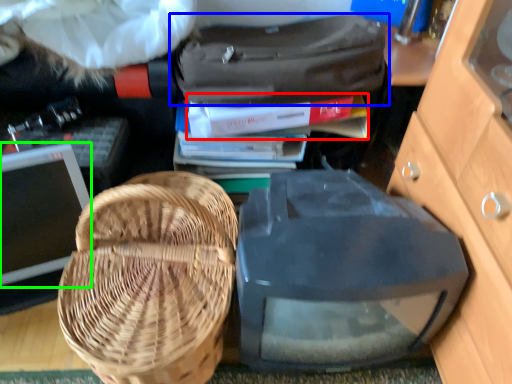
Question: Considering the real-world distances, which object is closest to book (highlighted by a red box)? luggage and bags (highlighted by a blue box) or computer monitor (highlighted by a green box).

Choices:
 (A) luggage and bags
 (B) computer monitor

Answer: (A)